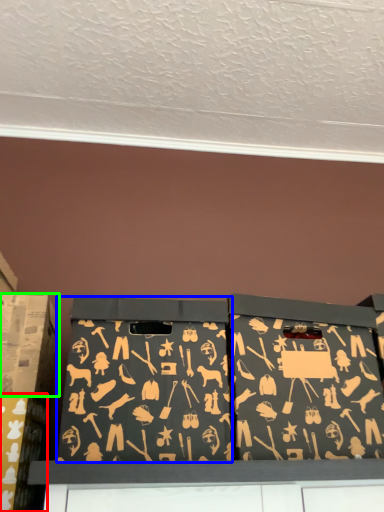
Question: Which is farther away from box (highlighted by a red box)? box (highlighted by a blue box) or box (highlighted by a green box)?

Choices:
 (A) box
 (B) box

Answer: (A)